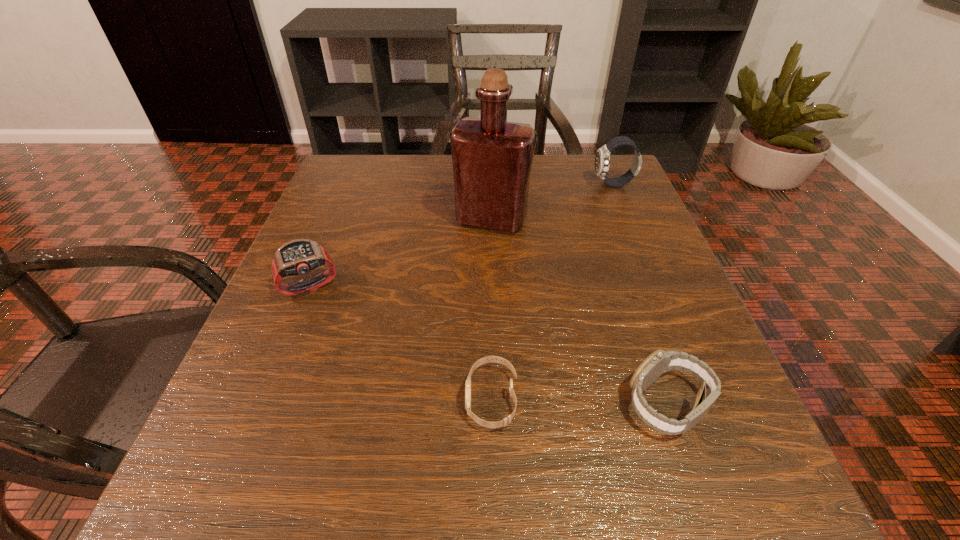
The width and height of the screenshot is (960, 540). What are the coordinates of `vacant space positioned on the face of the fourth shortest object` in the screenshot? It's located at (533, 185).

At what (x,y) coordinates should I click in order to perform the action: click on vacant region located 0.080m on the face of the fourth shortest object. Please return your answer as a coordinate pair (x, y). The height and width of the screenshot is (540, 960). Looking at the image, I should click on (559, 185).

Find the location of a particular element. This screenshot has width=960, height=540. free space located on the front of the third nearest watch is located at coordinates (215, 519).

Locate an element on the screen. This screenshot has height=540, width=960. free space located 0.130m on the face of the second watch from left to right is located at coordinates (372, 399).

Find the location of a particular element. free space located on the face of the second watch from left to right is located at coordinates (228, 399).

Locate an element on the screen. Image resolution: width=960 pixels, height=540 pixels. free space located 0.140m on the face of the second watch from left to right is located at coordinates (365, 399).

Where is `liquor that is at the far edge`? The height and width of the screenshot is (540, 960). liquor that is at the far edge is located at coordinates (492, 158).

The height and width of the screenshot is (540, 960). Find the location of `watch located at the far edge`. watch located at the far edge is located at coordinates (602, 160).

At what (x,y) coordinates should I click in order to perform the action: click on object at the left edge. Please return your answer as a coordinate pair (x, y). This screenshot has height=540, width=960. Looking at the image, I should click on (296, 257).

Find the location of `object at the far right corner`. object at the far right corner is located at coordinates (602, 160).